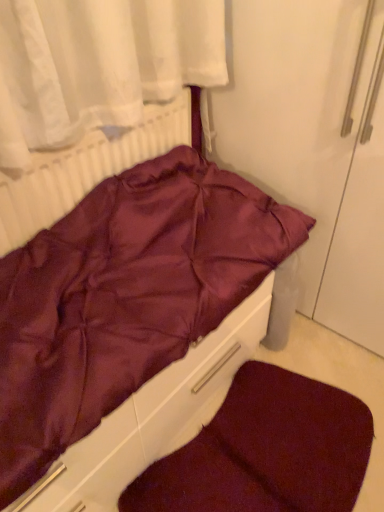
Question: Is burgundy satin bed at center beside white textured radiator at upper left?

Choices:
 (A) yes
 (B) no

Answer: (B)

Question: From the image's perspective, would you say burgundy satin bed at center is positioned over white textured radiator at upper left?

Choices:
 (A) no
 (B) yes

Answer: (A)

Question: From a real-world perspective, is burgundy satin bed at center over white textured radiator at upper left?

Choices:
 (A) no
 (B) yes

Answer: (A)

Question: Considering the relative sizes of burgundy satin bed at center and white textured radiator at upper left in the image provided, is burgundy satin bed at center smaller than white textured radiator at upper left?

Choices:
 (A) yes
 (B) no

Answer: (B)

Question: From a real-world perspective, is burgundy satin bed at center beneath white textured radiator at upper left?

Choices:
 (A) yes
 (B) no

Answer: (A)

Question: Considering the positions of white textured radiator at upper left and burgundy satin bed at center in the image, is white textured radiator at upper left taller or shorter than burgundy satin bed at center?

Choices:
 (A) short
 (B) tall

Answer: (B)

Question: Visually, is white textured radiator at upper left positioned to the left or to the right of burgundy satin bed at center?

Choices:
 (A) left
 (B) right

Answer: (A)

Question: Looking at their shapes, would you say white textured radiator at upper left is wider or thinner than burgundy satin bed at center?

Choices:
 (A) wide
 (B) thin

Answer: (B)

Question: Is white textured radiator at upper left spatially inside burgundy satin bed at center, or outside of it?

Choices:
 (A) outside
 (B) inside

Answer: (A)

Question: From a real-world perspective, is white textured radiator at upper left above or below burgundy plush dog bed at lower center?

Choices:
 (A) above
 (B) below

Answer: (A)

Question: Considering the positions of white textured radiator at upper left and burgundy plush dog bed at lower center in the image, is white textured radiator at upper left wider or thinner than burgundy plush dog bed at lower center?

Choices:
 (A) thin
 (B) wide

Answer: (A)

Question: In the image, is white textured radiator at upper left positioned in front of or behind burgundy plush dog bed at lower center?

Choices:
 (A) front
 (B) behind

Answer: (A)

Question: Is point (23, 224) closer or farther from the camera than point (170, 487)?

Choices:
 (A) farther
 (B) closer

Answer: (B)

Question: In terms of size, does burgundy satin bed at center appear bigger or smaller than burgundy plush dog bed at lower center?

Choices:
 (A) small
 (B) big

Answer: (B)

Question: Looking at their shapes, would you say burgundy satin bed at center is wider or thinner than burgundy plush dog bed at lower center?

Choices:
 (A) thin
 (B) wide

Answer: (A)